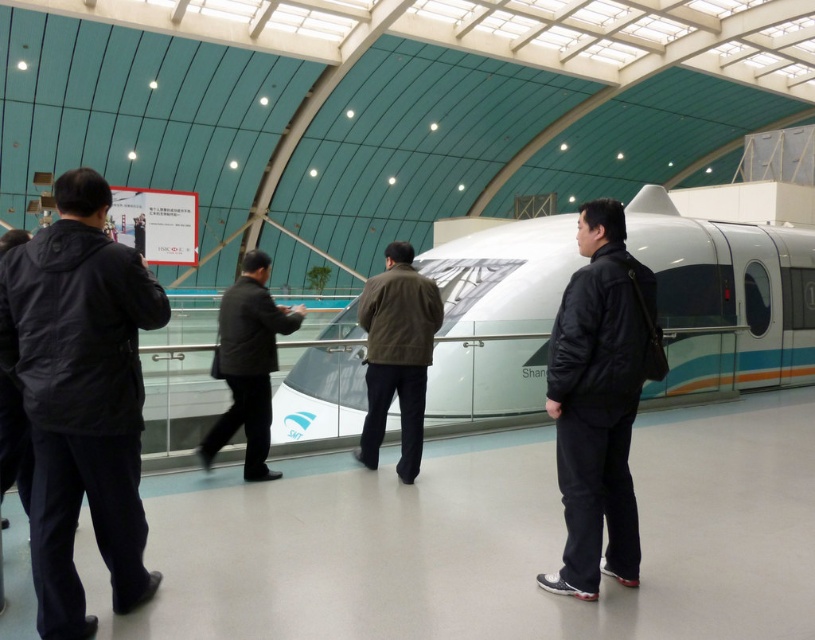
Question: Does black matte jacket at left have a larger size compared to dark gray suit at center?

Choices:
 (A) yes
 (B) no

Answer: (B)

Question: Which point is closer to the camera?

Choices:
 (A) (86, 636)
 (B) (628, 488)
 (C) (29, 460)
 (D) (492, 365)

Answer: (A)

Question: Based on their relative distances, which object is nearer to the dark gray suit at center?

Choices:
 (A) black matte jacket at center
 (B) white glossy train at center

Answer: (A)

Question: Where is black matte jacket at left located in relation to dark gray jacket at left in the image?

Choices:
 (A) left
 (B) right

Answer: (B)

Question: Is white glossy train at center closer to camera compared to dark gray suit at center?

Choices:
 (A) no
 (B) yes

Answer: (A)

Question: Which point appears closest to the camera in this image?

Choices:
 (A) (659, 218)
 (B) (51, 296)

Answer: (B)